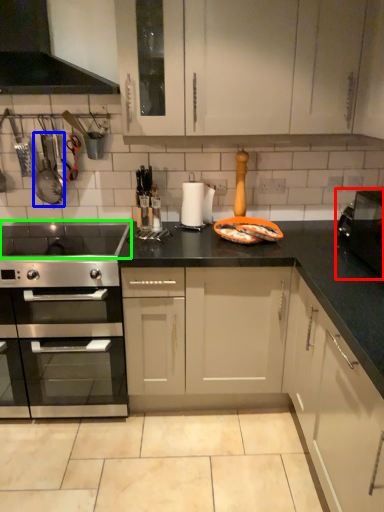
Question: Considering the real-world distances, which object is farthest from appliance (highlighted by a red box)? appliance (highlighted by a blue box) or gas stove (highlighted by a green box)?

Choices:
 (A) appliance
 (B) gas stove

Answer: (A)